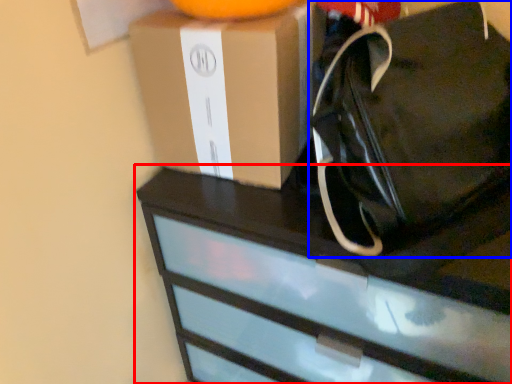
Question: Which of the following is the farthest to the observer, chest of drawers (highlighted by a red box) or tote bag (highlighted by a blue box)?

Choices:
 (A) chest of drawers
 (B) tote bag

Answer: (A)